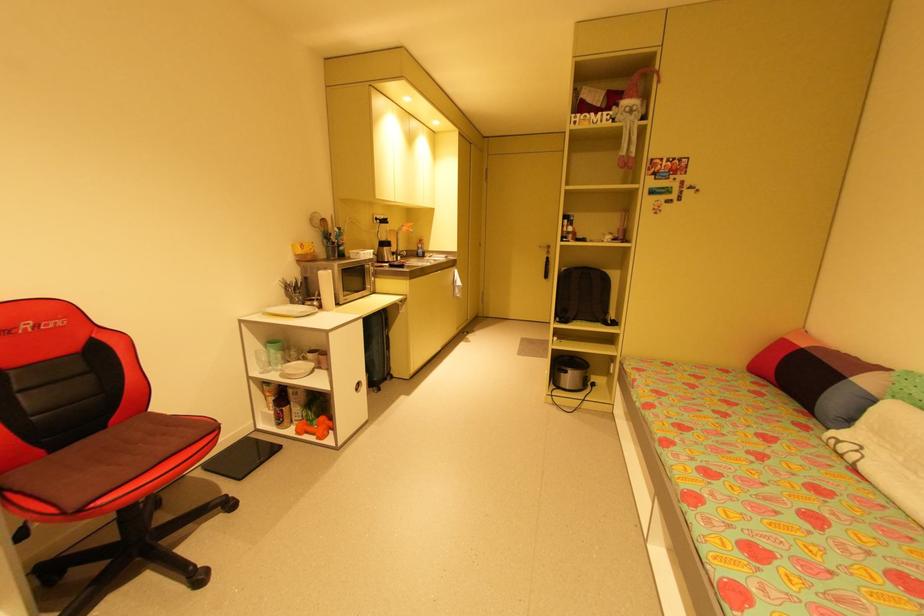
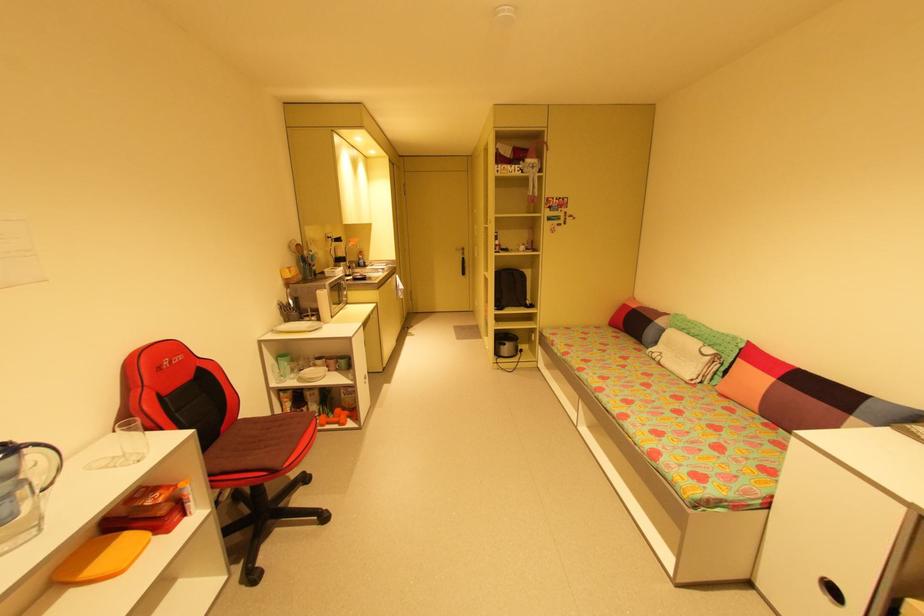
Locate, in the second image, the point that corresponds to the point at 302,360 in the first image.

(313, 367)